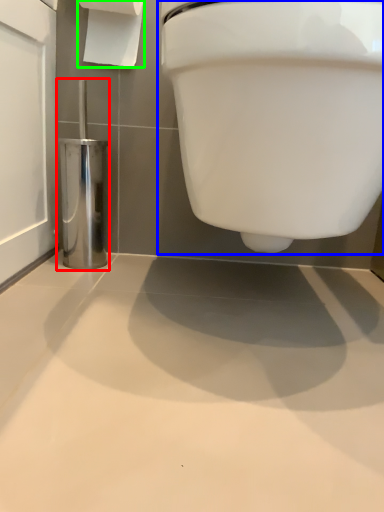
Question: Estimate the real-world distances between objects in this image. Which object is farther from porcelain (highlighted by a red box), toilet (highlighted by a blue box) or toilet paper (highlighted by a green box)?

Choices:
 (A) toilet
 (B) toilet paper

Answer: (A)